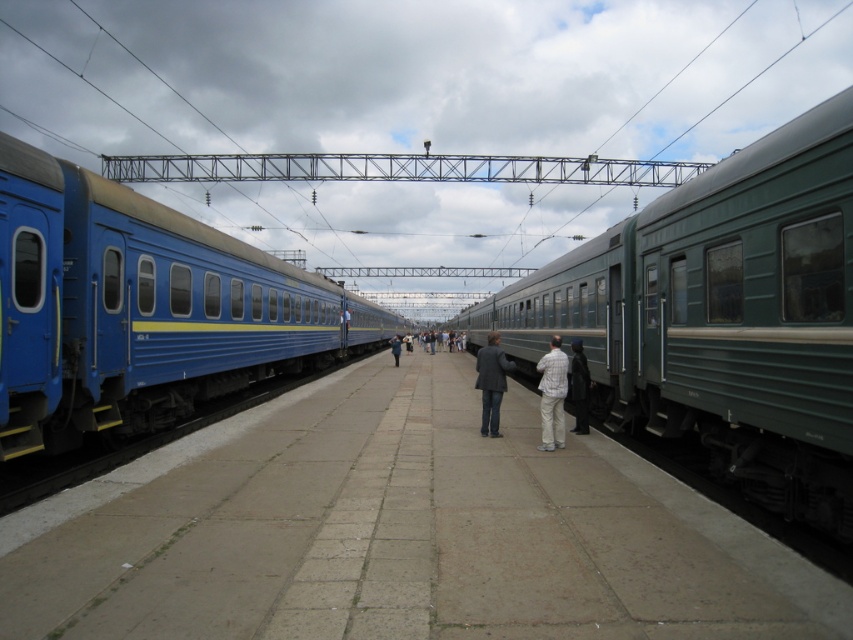
You are a maintenance worker needing to place a 1.8 meter ladder on the concrete platform at center. Considering the height of the dark gray jacket at center, will the ladder fit vertically on the platform without exceeding its height?

The concrete platform at center is not as tall as the dark gray jacket at center. Since jackets typically are about the same height as a person, and assuming the jacket is worn by someone of average height around 1.7 meters, the platform is shorter than 1.7 meters. The ladder is 1.8 meters tall, so it would exceed the platform height and not fit vertically.

You are a passenger waiting on the platform between the two trains. You see the green metallic train at right and the plaid shirt at center. Which object is closer to you?

The plaid shirt at center is closer to you because the green metallic train at right is located above it, meaning the shirt is positioned in front of the train.

You are a photographer standing on the platform between the two trains. You notice two people wearing a plaid shirt at center and a dark gray coat at center. Which person is positioned closer to the right side of the platform?

The plaid shirt at center is to the right of dark gray coat at center, so the person wearing the plaid shirt at center is positioned closer to the right side of the platform.